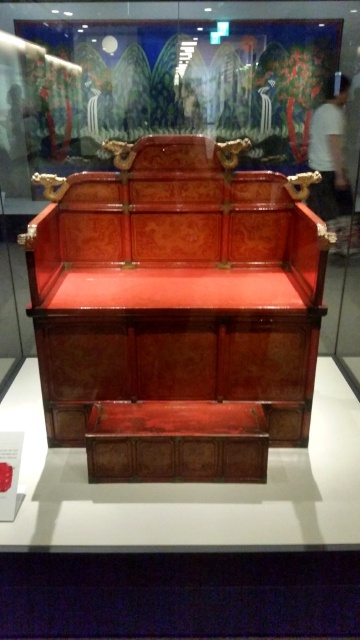
Does wooden carved bench at center appear on the right side of shiny brown wooden chest at center?

Incorrect, wooden carved bench at center is not on the right side of shiny brown wooden chest at center.

What are the coordinates of `wooden carved bench at center` in the screenshot? It's located at (176, 285).